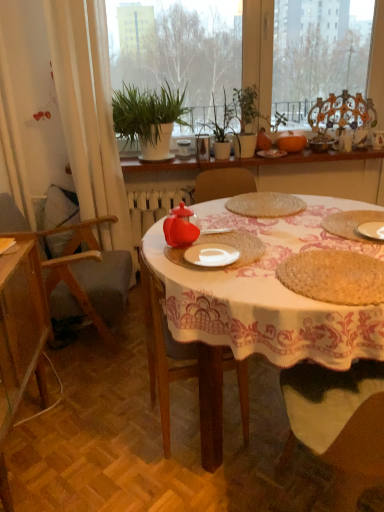
Find the location of a particular element. The width and height of the screenshot is (384, 512). free location above white ceramic plate at center (from a real-world perspective) is located at coordinates (207, 252).